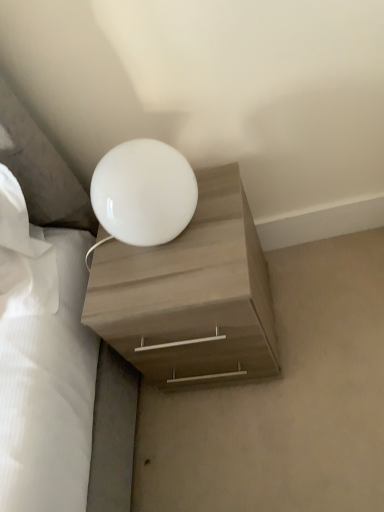
Where is `free location above white glossy lamp at upper center (from a real-world perspective)`? The image size is (384, 512). free location above white glossy lamp at upper center (from a real-world perspective) is located at coordinates (291, 370).